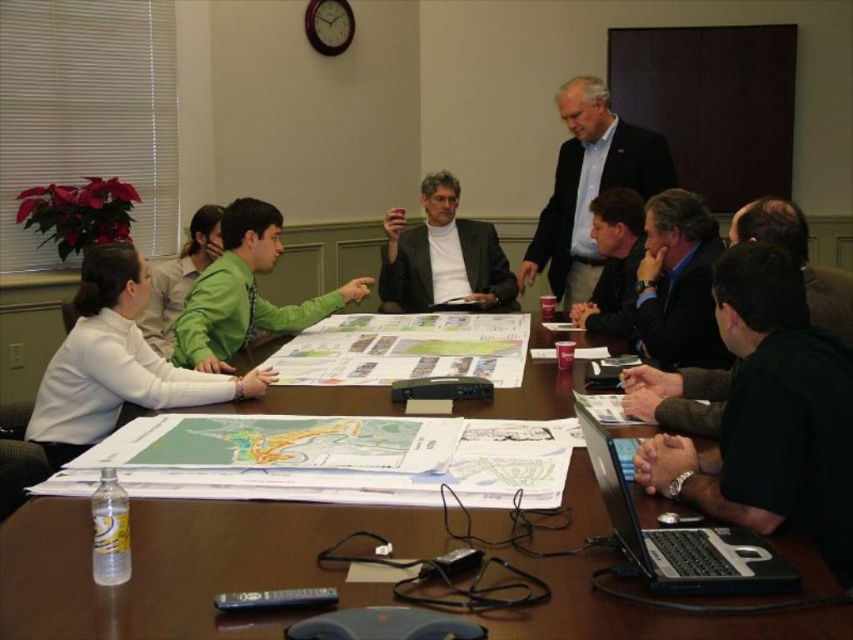
Question: Does white paper map at center have a larger size compared to dark blue suit at upper right?

Choices:
 (A) no
 (B) yes

Answer: (A)

Question: Which point is closer to the camera?

Choices:
 (A) green matte shirt at upper left
 (B) dark brown leather jacket at upper center
 (C) black plastic laptop at lower right
 (D) black leather jacket at lower right

Answer: (C)

Question: Among these objects, which one is nearest to the camera?

Choices:
 (A) green matte shirt at upper left
 (B) dark blue suit at upper right
 (C) blue shirt at upper center
 (D) black plastic laptop at lower right

Answer: (D)

Question: Can you confirm if green matte shirt at center is positioned to the right of dark blue suit at upper right?

Choices:
 (A) no
 (B) yes

Answer: (A)

Question: Considering the relative positions of white paper map at center and blue shirt at upper center in the image provided, where is white paper map at center located with respect to blue shirt at upper center?

Choices:
 (A) left
 (B) right

Answer: (A)

Question: Which of these objects is positioned closest to the dark blue suit at upper right?

Choices:
 (A) blue shirt at upper center
 (B) black leather jacket at lower right
 (C) green matte shirt at upper left

Answer: (A)